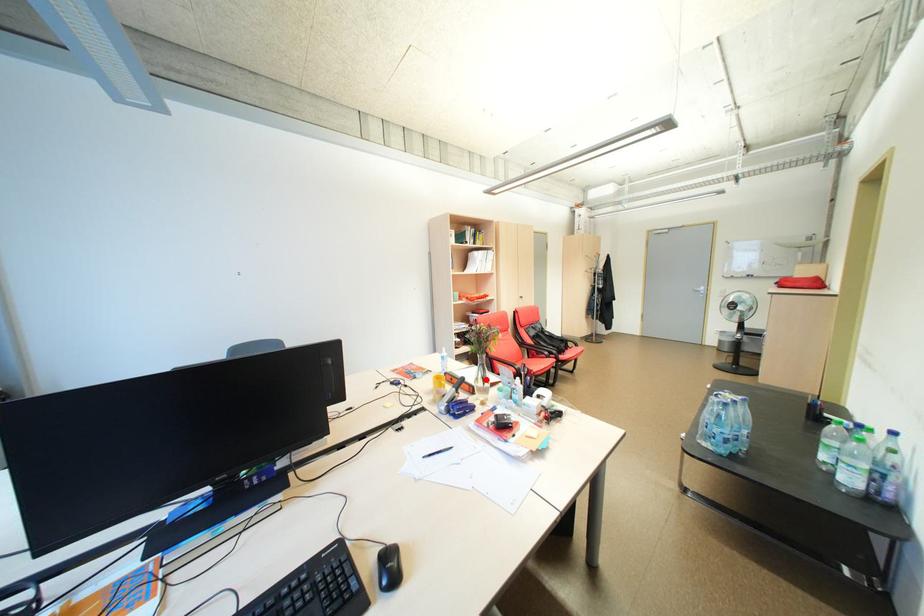
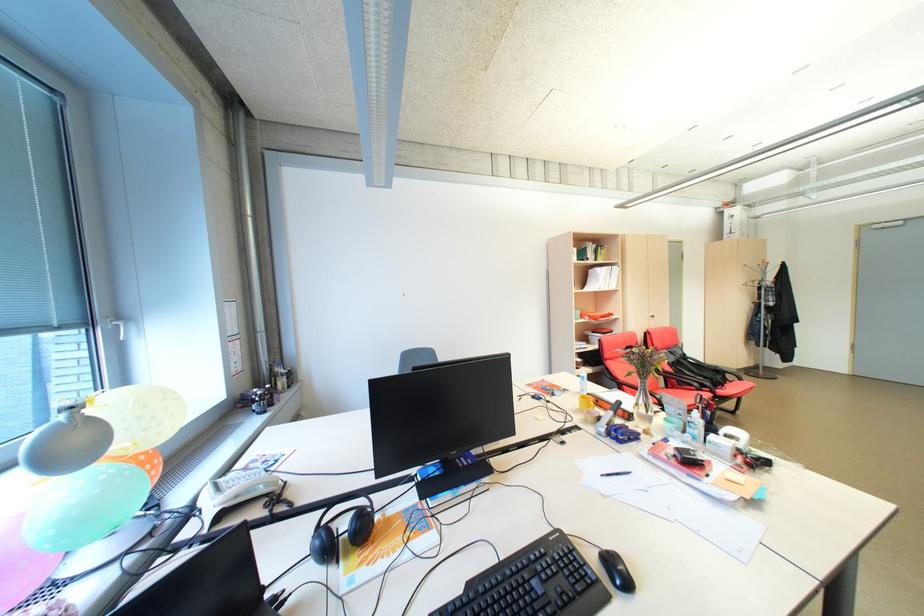
Question: A red point is marked in image1. In image2, is the corresponding 3D point closer to the camera or farther? Reply with the corresponding letter.

Choices:
 (A) The corresponding 3D point is closer.
 (B) The corresponding 3D point is farther.

Answer: (A)